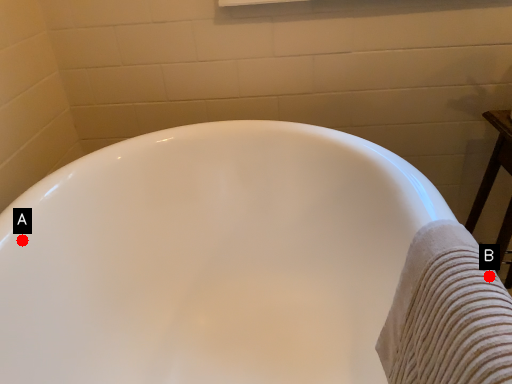
Question: Two points are circled on the image, labeled by A and B beside each circle. Which point appears closest to the camera in this image?

Choices:
 (A) A is closer
 (B) B is closer

Answer: (B)